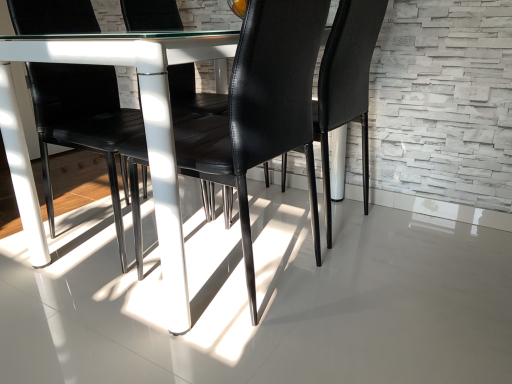
Question: Should I look upward or downward to see white glossy concrete at center?

Choices:
 (A) down
 (B) up

Answer: (A)

Question: Is white glossy concrete at center aimed at black leather chair at center, marked as the first chair in a front-to-back arrangement?

Choices:
 (A) no
 (B) yes

Answer: (A)

Question: Is white glossy concrete at center surrounding black leather chair at center, marked as the first chair in a front-to-back arrangement?

Choices:
 (A) no
 (B) yes

Answer: (A)

Question: Is white glossy concrete at center to the left of black leather chair at center, marked as the first chair in a front-to-back arrangement, from the viewer's perspective?

Choices:
 (A) yes
 (B) no

Answer: (A)

Question: Would you consider white glossy concrete at center to be distant from black leather chair at center, arranged as the 2th chair when viewed from the back?

Choices:
 (A) yes
 (B) no

Answer: (B)

Question: Is white glossy concrete at center positioned beyond the bounds of black leather chair at center, arranged as the 2th chair when viewed from the back?

Choices:
 (A) yes
 (B) no

Answer: (A)

Question: From the image's perspective, is white glossy concrete at center over black leather chair at center, arranged as the 2th chair when viewed from the back?

Choices:
 (A) yes
 (B) no

Answer: (B)

Question: Is black leather chair at center, arranged as the 2th chair when viewed from the back, thinner than white glossy concrete at center?

Choices:
 (A) no
 (B) yes

Answer: (B)

Question: Is black leather chair at center, arranged as the 2th chair when viewed from the back, shorter than white glossy concrete at center?

Choices:
 (A) yes
 (B) no

Answer: (B)

Question: Considering the relative positions of black leather chair at center, arranged as the 2th chair when viewed from the back, and white glossy concrete at center in the image provided, is black leather chair at center, arranged as the 2th chair when viewed from the back, to the right of white glossy concrete at center from the viewer's perspective?

Choices:
 (A) no
 (B) yes

Answer: (B)

Question: Is the depth of black leather chair at center, marked as the first chair in a front-to-back arrangement, less than that of white glossy concrete at center?

Choices:
 (A) yes
 (B) no

Answer: (B)

Question: From a real-world perspective, is black leather chair at center, marked as the first chair in a front-to-back arrangement, located beneath white glossy concrete at center?

Choices:
 (A) no
 (B) yes

Answer: (A)

Question: Considering the relative sizes of black leather chair at center, marked as the first chair in a front-to-back arrangement, and white glossy concrete at center in the image provided, is black leather chair at center, marked as the first chair in a front-to-back arrangement, bigger than white glossy concrete at center?

Choices:
 (A) no
 (B) yes

Answer: (B)

Question: Is black leather chair at center, marked as the first chair in a front-to-back arrangement, taller than black leather chair at center, arranged as the first chair when viewed from the back?

Choices:
 (A) no
 (B) yes

Answer: (A)